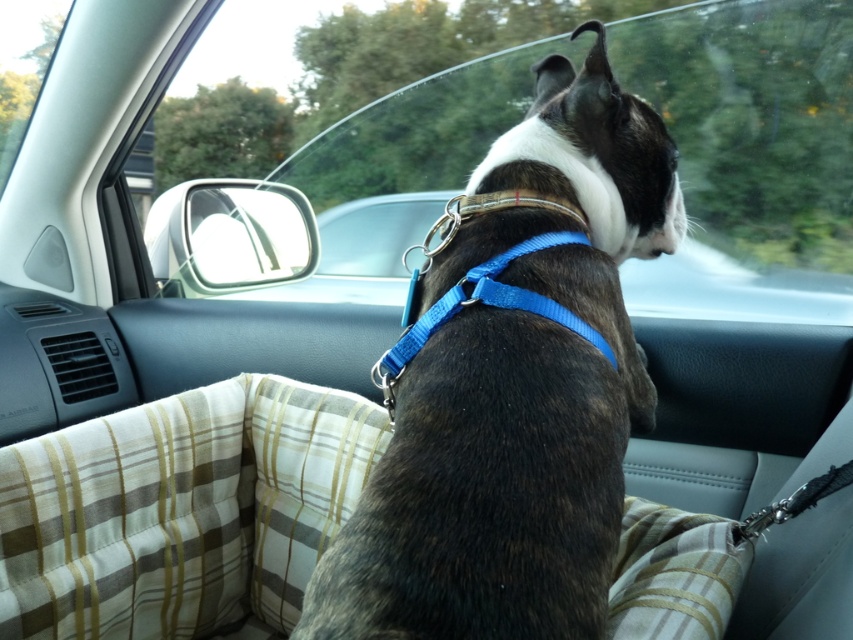
You are sitting in the front passenger seat of the car. You want to hand a treat to the dog sitting in the back seat. The treat is in your hand, and you need to reach it through the transparent glass car window at center. Can you successfully hand the treat to the dog without opening the window?

The distance between you and the transparent glass car window at center is 6.22 feet. Since the window is transparent but not open, you cannot physically reach through it to hand the treat to the dog. You would need to open the window or find another way to pass the treat.

You are a passenger in the car and want to place a small toy on the seat behind you. The toy requires a space of 15 cm in width. Can the brown textured dog at center allow enough space for the toy?

The brown textured dog at center is located at point (514, 384), but without information about the seat dimensions or the dog size, it is impossible to determine if there is enough space for the toy. Please check the seat size and the dog size first.

You are a passenger in the car and want to reach for the blue nylon neckband at center to adjust it. Which direction should you move your hand to reach it from the brown textured dog at center?

The blue nylon neckband at center is to the left of the brown textured dog at center, so you should move your hand to the left to reach it.